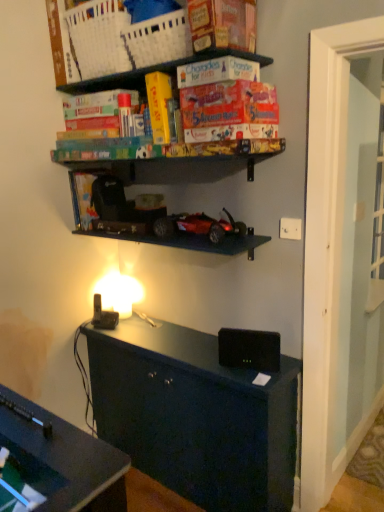
Question: Considering the positions of shiny red plastic toy car at center and white plastic electric outlet at upper right in the image, is shiny red plastic toy car at center bigger or smaller than white plastic electric outlet at upper right?

Choices:
 (A) big
 (B) small

Answer: (A)

Question: Does point (208, 220) appear closer or farther from the camera than point (284, 230)?

Choices:
 (A) closer
 (B) farther

Answer: (B)

Question: Considering the real-world distances, which object is closest to the black matte speaker at center?

Choices:
 (A) white plastic basket at upper center
 (B) shiny red plastic toy car at center
 (C) white plastic electric outlet at upper right
 (D) orange matte board game at upper center

Answer: (B)

Question: Estimate the real-world distances between objects in this image. Which object is farther from the white plastic basket at upper center?

Choices:
 (A) orange matte board game at upper center
 (B) black matte speaker at center
 (C) shiny red plastic toy car at center
 (D) white plastic electric outlet at upper right

Answer: (B)